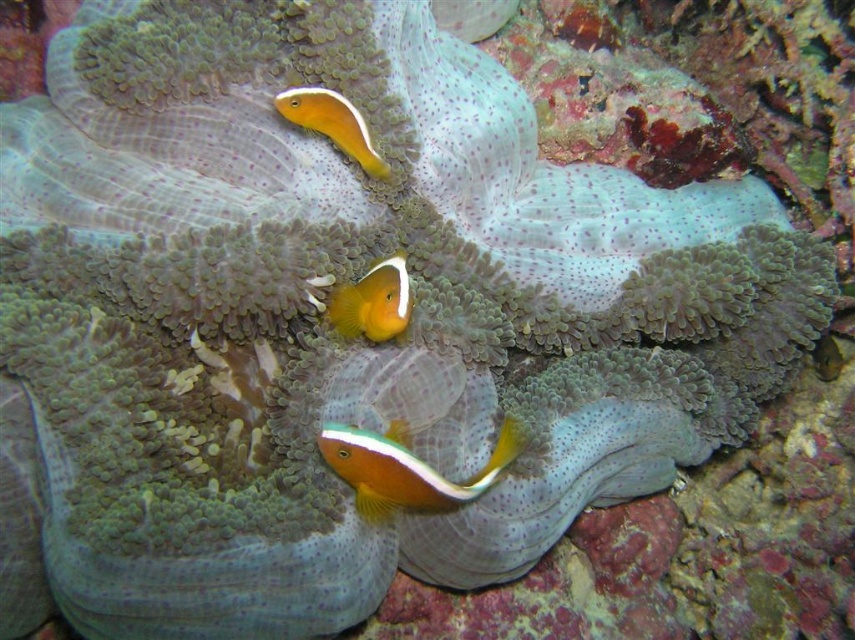
You are a marine biologist observing the underwater scene. You notice two clownfish, the orange matte fish at center and the orange glossy clownfish at upper center. Which one is larger in size?

The orange matte fish at center is bigger than the orange glossy clownfish at upper center, so the orange matte fish at center is larger in size.